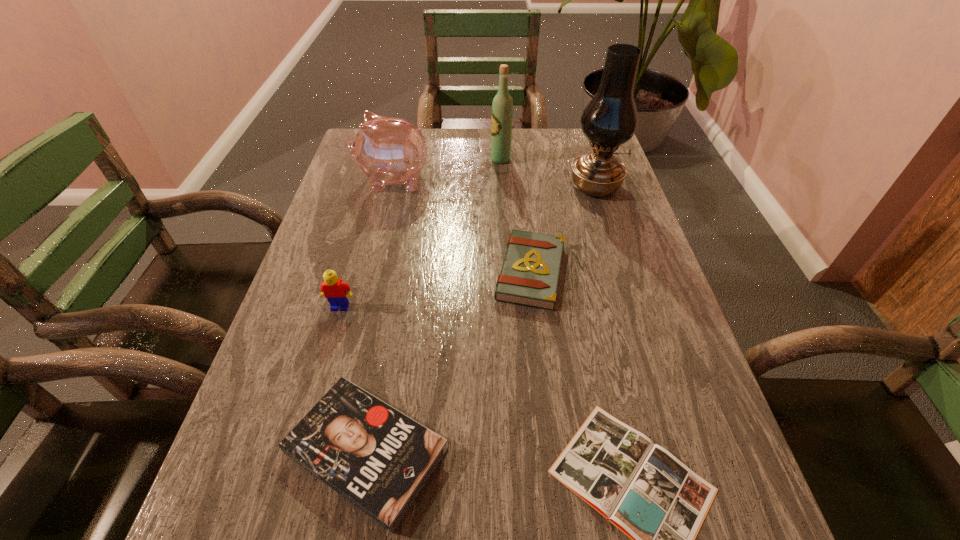
Where is `the tallest object`? the tallest object is located at coordinates [x=610, y=119].

The height and width of the screenshot is (540, 960). Find the location of `the second tallest object`. the second tallest object is located at coordinates (502, 106).

Identify the location of the third tallest object. (388, 150).

The height and width of the screenshot is (540, 960). Find the location of `the fourth shortest object`. the fourth shortest object is located at coordinates (336, 291).

Identify the location of the farthest book. This screenshot has width=960, height=540. (529, 276).

Locate an element on the screen. the leftmost book is located at coordinates (379, 459).

Where is `vacant space positioned on the back of the tallest object`? Image resolution: width=960 pixels, height=540 pixels. vacant space positioned on the back of the tallest object is located at coordinates (582, 146).

The width and height of the screenshot is (960, 540). What are the coordinates of `free point located on the front-facing side of the wine bottle` in the screenshot? It's located at (401, 159).

Where is `free space located on the front-facing side of the wine bottle`? The image size is (960, 540). free space located on the front-facing side of the wine bottle is located at coordinates (475, 159).

Find the location of a particular element. vacant space situated 0.320m on the front-facing side of the wine bottle is located at coordinates (392, 159).